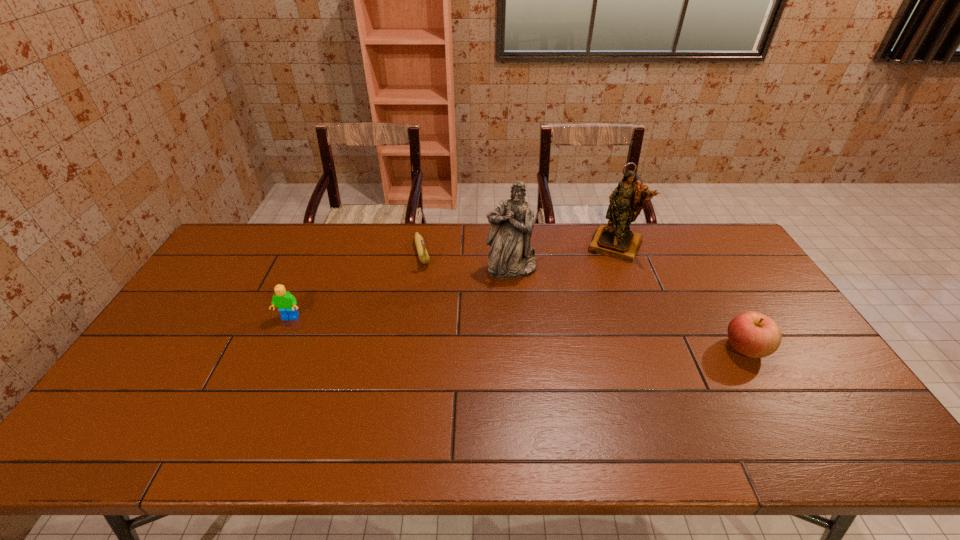
Locate an element on the screen. free location located on the front-facing side of the second object from right to left is located at coordinates coord(573,333).

This screenshot has height=540, width=960. I want to click on vacant area situated 0.270m on the front-facing side of the second object from right to left, so click(584, 310).

Locate an element on the screen. Image resolution: width=960 pixels, height=540 pixels. free space located on the front-facing side of the left figurine is located at coordinates (520, 306).

At what (x,y) coordinates should I click in order to perform the action: click on vacant space located on the front-facing side of the left figurine. Please return your answer as a coordinate pair (x, y). Image resolution: width=960 pixels, height=540 pixels. Looking at the image, I should click on (519, 301).

In order to click on vacant area situated 0.160m on the front-facing side of the left figurine in this screenshot , I will do `click(523, 315)`.

Locate an element on the screen. Image resolution: width=960 pixels, height=540 pixels. blank space located at the stem of the fourth object from right to left is located at coordinates (444, 343).

I want to click on free spot located at the stem of the fourth object from right to left, so click(x=445, y=351).

I want to click on blank space located at the stem of the fourth object from right to left, so click(433, 306).

Where is `banana present at the far edge`? Image resolution: width=960 pixels, height=540 pixels. banana present at the far edge is located at coordinates (424, 258).

In order to click on object located at the right edge in this screenshot , I will do `click(753, 334)`.